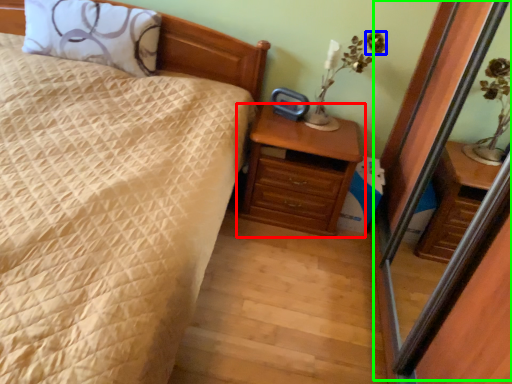
Question: Estimate the real-world distances between objects in this image. Which object is farther from chest of drawers (highlighted by a red box), flower (highlighted by a blue box) or screen door (highlighted by a green box)?

Choices:
 (A) flower
 (B) screen door

Answer: (A)